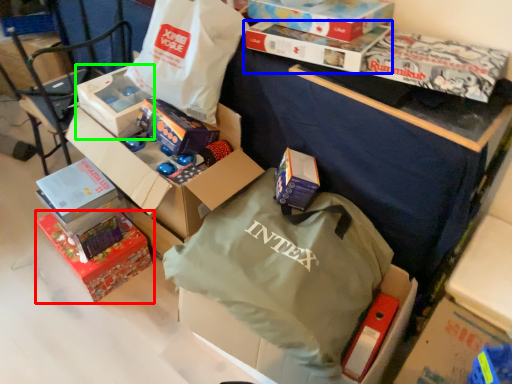
Question: Estimate the real-world distances between objects in this image. Which object is farther from box (highlighted by a red box), box (highlighted by a blue box) or box (highlighted by a green box)?

Choices:
 (A) box
 (B) box

Answer: (A)